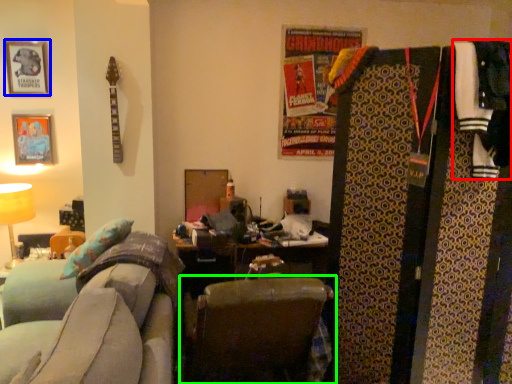
Question: Estimate the real-world distances between objects in this image. Which object is farther from clothing (highlighted by a red box), picture frame (highlighted by a blue box) or chair (highlighted by a green box)?

Choices:
 (A) picture frame
 (B) chair

Answer: (A)